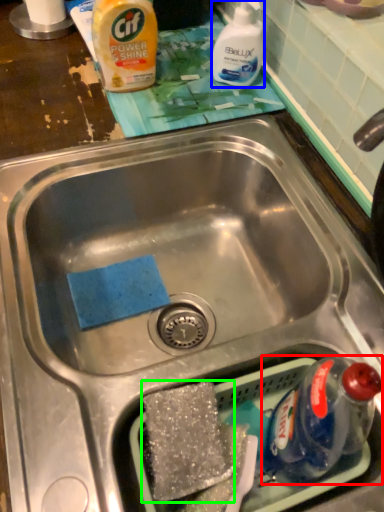
Question: Based on their relative distances, which object is nearer to bottle (highlighted by a red box)? Choose from cleaning product (highlighted by a blue box) and food (highlighted by a green box).

Choices:
 (A) cleaning product
 (B) food

Answer: (B)